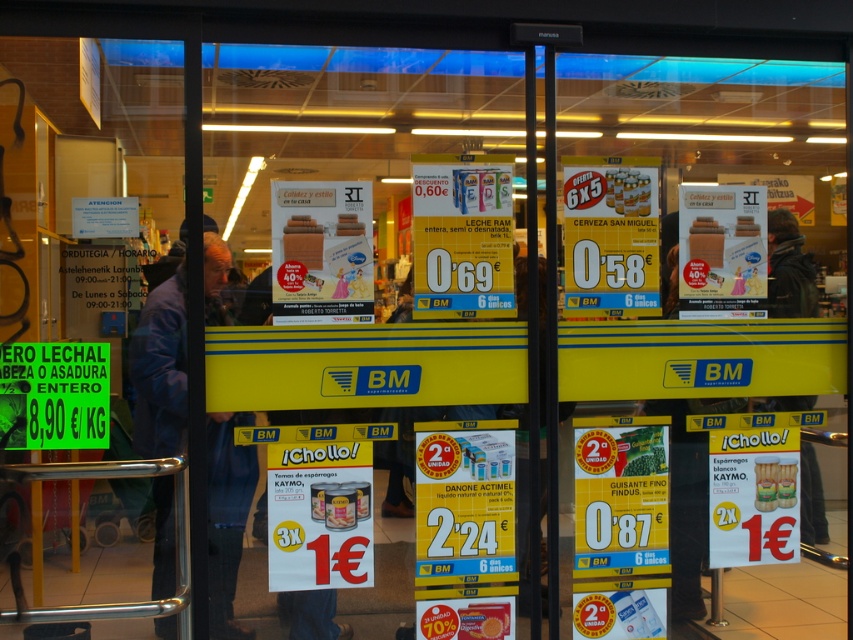
Question: Can you confirm if dark blue jacket at left is bigger than dark green jacket at center?

Choices:
 (A) yes
 (B) no

Answer: (A)

Question: Is smooth wooden stick at center to the left of matte cardboard beer can at center from the viewer's perspective?

Choices:
 (A) yes
 (B) no

Answer: (B)

Question: Estimate the real-world distances between objects in this image. Which object is closer to the dark blue jacket at left?

Choices:
 (A) transparent glass door at left
 (B) smooth wooden stick at center

Answer: (A)

Question: Which point is farther to the camera?

Choices:
 (A) matte cardboard beer can at center
 (B) dark green jacket at center
 (C) transparent glass door at left

Answer: (B)

Question: Is smooth wooden stick at center wider than matte cardboard beer can at center?

Choices:
 (A) no
 (B) yes

Answer: (A)

Question: Estimate the real-world distances between objects in this image. Which object is closer to the matte cardboard beer can at center?

Choices:
 (A) smooth wooden stick at center
 (B) dark blue jacket at left

Answer: (A)